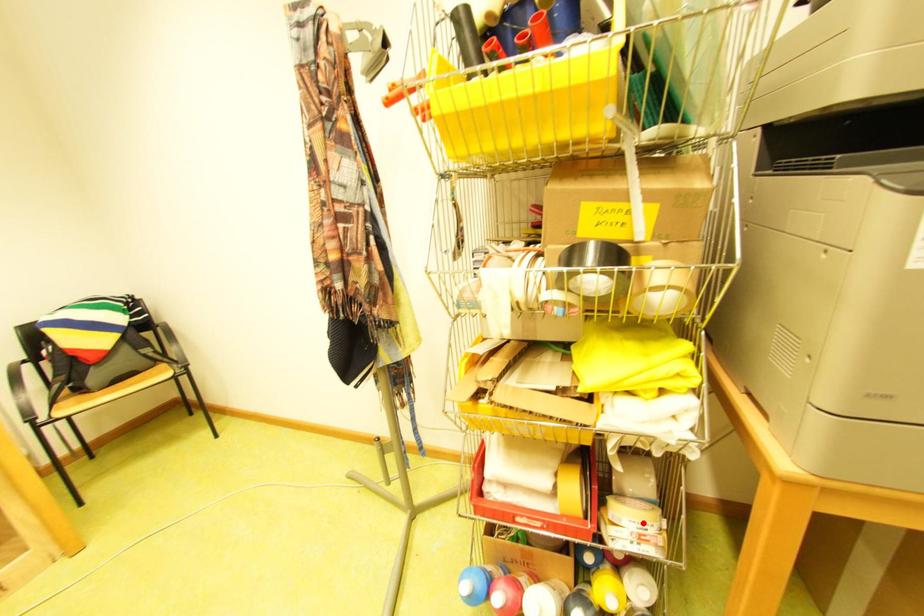
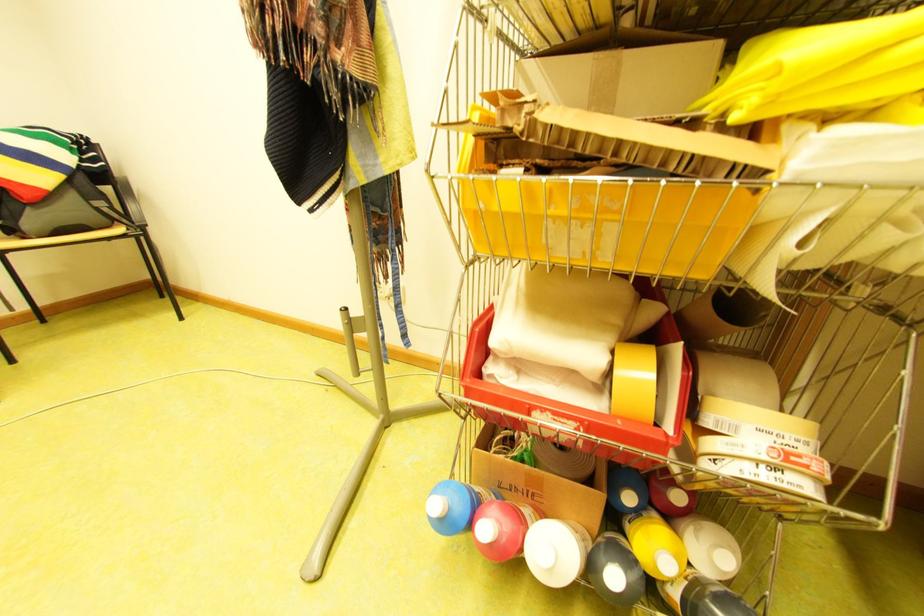
Locate, in the second image, the point that corresponds to the highlighted location in the first image.

(772, 432)